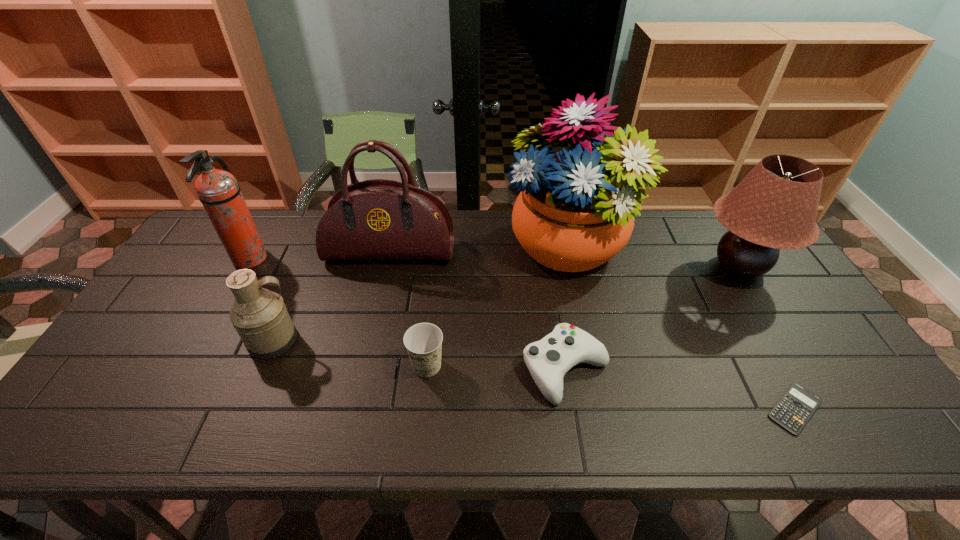
Find the location of `handbag present at the far edge`. handbag present at the far edge is located at coordinates (377, 219).

Find the location of a particular element. The width and height of the screenshot is (960, 540). lampshade at the far edge is located at coordinates (774, 207).

You are a GUI agent. You are given a task and a screenshot of the screen. Output one action in this format:
    pyautogui.click(x=<x>, y=<y>)
    Task: Click on the control present at the near edge
    This screenshot has width=960, height=540.
    Given the screenshot: What is the action you would take?
    pyautogui.click(x=548, y=360)

Locate an element on the screen. calculator located at the near edge is located at coordinates (794, 409).

Where is `object situated at the left edge`? object situated at the left edge is located at coordinates (218, 191).

Where is `lampshade located at the right edge`? lampshade located at the right edge is located at coordinates (774, 207).

Identify the location of calculator at the right edge. The width and height of the screenshot is (960, 540). (794, 409).

Locate an element on the screen. object that is positioned at the far left corner is located at coordinates (218, 191).

Where is `object located at the far right corner`? This screenshot has height=540, width=960. object located at the far right corner is located at coordinates (774, 207).

Where is `object situated at the near right corner`? object situated at the near right corner is located at coordinates coord(794,409).